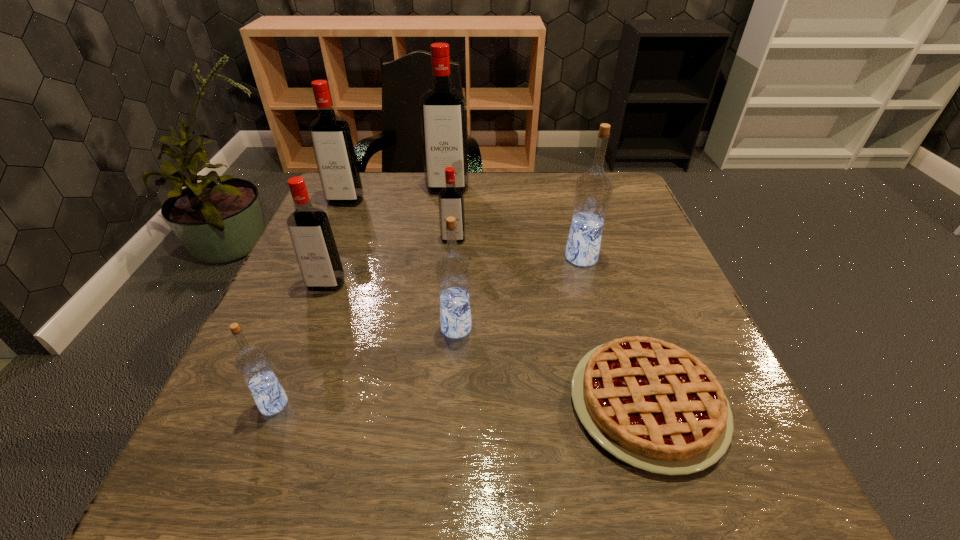
Locate an element on the screen. The height and width of the screenshot is (540, 960). free space in the image that satisfies the following two spatial constraints: 1. on the front and back of the second nearest vodka; 2. on the right side of the smallest red vodka is located at coordinates (446, 328).

This screenshot has width=960, height=540. What are the coordinates of `vacant region that satisfies the following two spatial constraints: 1. on the front and back of the sixth farthest vodka; 2. on the right side of the biggest red vodka` in the screenshot? It's located at (432, 328).

This screenshot has height=540, width=960. Find the location of `free location that satisfies the following two spatial constraints: 1. on the front and back of the second biggest red vodka; 2. on the right side of the second blue vodka from right to left`. free location that satisfies the following two spatial constraints: 1. on the front and back of the second biggest red vodka; 2. on the right side of the second blue vodka from right to left is located at coordinates (290, 328).

Where is `vacant space that satisfies the following two spatial constraints: 1. on the front and back of the biggest red vodka; 2. on the right side of the rightmost blue vodka`? vacant space that satisfies the following two spatial constraints: 1. on the front and back of the biggest red vodka; 2. on the right side of the rightmost blue vodka is located at coordinates (440, 257).

This screenshot has width=960, height=540. Find the location of `vacant point that satisfies the following two spatial constraints: 1. on the front and back of the rightmost vodka; 2. on the right side of the third smallest red vodka`. vacant point that satisfies the following two spatial constraints: 1. on the front and back of the rightmost vodka; 2. on the right side of the third smallest red vodka is located at coordinates click(321, 257).